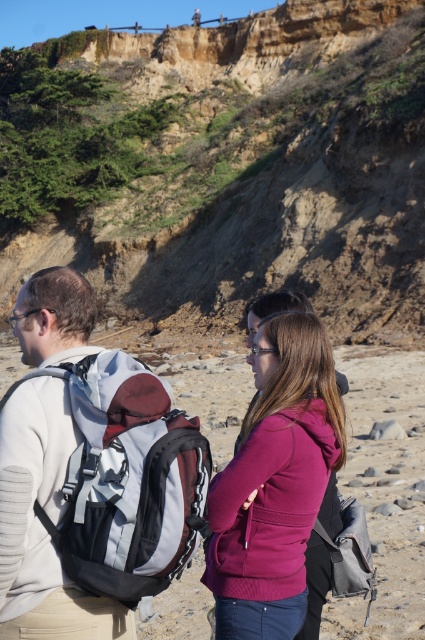
Can you confirm if earthy brown cliff at upper center is taller than purple fleece jacket at center?

Yes, earthy brown cliff at upper center is taller than purple fleece jacket at center.

What do you see at coordinates (237, 170) in the screenshot? I see `earthy brown cliff at upper center` at bounding box center [237, 170].

The width and height of the screenshot is (425, 640). What are the coordinates of `earthy brown cliff at upper center` in the screenshot? It's located at pos(237,170).

Is matte black backpack at center thinner than purple fleece jacket at center?

No.

Does point (138, 627) come in front of point (227, 545)?

No, (138, 627) is behind (227, 545).

This screenshot has height=640, width=425. Find the location of `matte black backpack at center`. matte black backpack at center is located at coordinates (385, 492).

Is gray fabric backpack at center to the left of matte black backpack at center from the viewer's perspective?

Correct, you'll find gray fabric backpack at center to the left of matte black backpack at center.

Is the position of gray fabric backpack at center more distant than that of matte black backpack at center?

No, gray fabric backpack at center is in front of matte black backpack at center.

What do you see at coordinates (127, 480) in the screenshot? I see `gray fabric backpack at center` at bounding box center [127, 480].

This screenshot has width=425, height=640. Identify the location of gray fabric backpack at center. (127, 480).